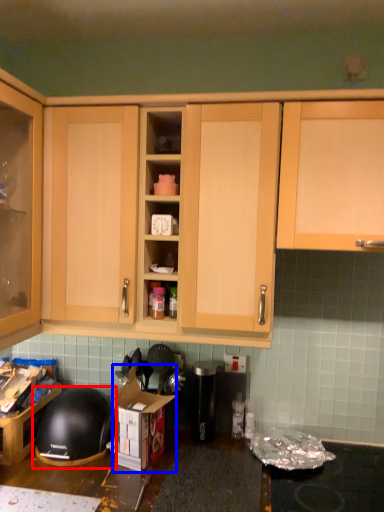
Question: Which object is further to the camera taking this photo, helmet (highlighted by a red box) or cardboard box (highlighted by a blue box)?

Choices:
 (A) helmet
 (B) cardboard box

Answer: (A)